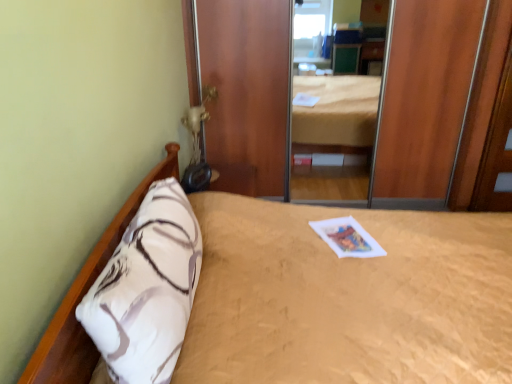
Question: From the image's perspective, is wooden door at right located above white soft pillow at left?

Choices:
 (A) yes
 (B) no

Answer: (A)

Question: Can you confirm if wooden door at right is wider than white soft pillow at left?

Choices:
 (A) no
 (B) yes

Answer: (A)

Question: Is wooden door at right smaller than white soft pillow at left?

Choices:
 (A) yes
 (B) no

Answer: (A)

Question: Is wooden door at right at the left side of white soft pillow at left?

Choices:
 (A) yes
 (B) no

Answer: (B)

Question: Is wooden door at right beside white soft pillow at left?

Choices:
 (A) no
 (B) yes

Answer: (A)

Question: From the image's perspective, is beige textured bed at center positioned above or below white paper magazine at center?

Choices:
 (A) above
 (B) below

Answer: (B)

Question: Considering the positions of point (440, 294) and point (366, 236), is point (440, 294) closer or farther from the camera than point (366, 236)?

Choices:
 (A) closer
 (B) farther

Answer: (A)

Question: Is beige textured bed at center inside or outside of white paper magazine at center?

Choices:
 (A) outside
 (B) inside

Answer: (A)

Question: In terms of height, does beige textured bed at center look taller or shorter compared to white paper magazine at center?

Choices:
 (A) short
 (B) tall

Answer: (B)

Question: Is white paper magazine at center situated inside white soft pillow at left or outside?

Choices:
 (A) outside
 (B) inside

Answer: (A)

Question: From a real-world perspective, is white paper magazine at center physically located above or below white soft pillow at left?

Choices:
 (A) above
 (B) below

Answer: (B)

Question: Considering the positions of white paper magazine at center and white soft pillow at left in the image, is white paper magazine at center bigger or smaller than white soft pillow at left?

Choices:
 (A) small
 (B) big

Answer: (A)

Question: Does point (327, 235) appear closer or farther from the camera than point (147, 218)?

Choices:
 (A) closer
 (B) farther

Answer: (B)

Question: Considering the positions of beige textured bed at center and wooden door at right in the image, is beige textured bed at center taller or shorter than wooden door at right?

Choices:
 (A) tall
 (B) short

Answer: (B)

Question: From the image's perspective, is beige textured bed at center positioned above or below wooden door at right?

Choices:
 (A) below
 (B) above

Answer: (A)